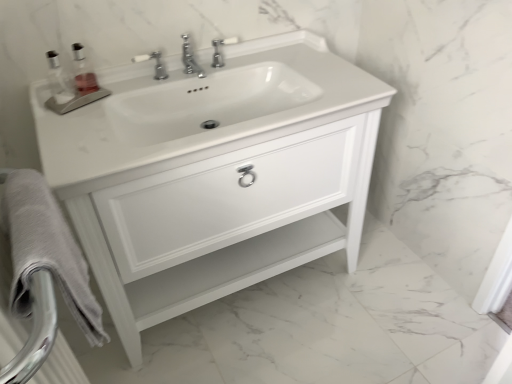
Question: From a real-world perspective, does white glossy sink at center sit lower than clear glass soap dispenser at upper left?

Choices:
 (A) yes
 (B) no

Answer: (A)

Question: Is white glossy sink at center oriented away from clear glass soap dispenser at upper left?

Choices:
 (A) no
 (B) yes

Answer: (A)

Question: Is white glossy sink at center at the right side of clear glass soap dispenser at upper left?

Choices:
 (A) yes
 (B) no

Answer: (A)

Question: Can you confirm if white glossy sink at center is shorter than clear glass soap dispenser at upper left?

Choices:
 (A) yes
 (B) no

Answer: (B)

Question: Is white glossy sink at center with clear glass soap dispenser at upper left?

Choices:
 (A) no
 (B) yes

Answer: (A)

Question: From a real-world perspective, is white glossy sink at center on clear glass soap dispenser at upper left?

Choices:
 (A) no
 (B) yes

Answer: (A)

Question: From the image's perspective, is white glossy cabinet at center on top of chrome metallic faucet at center?

Choices:
 (A) no
 (B) yes

Answer: (A)

Question: Is the depth of white glossy cabinet at center less than that of chrome metallic faucet at center?

Choices:
 (A) no
 (B) yes

Answer: (B)

Question: Is white glossy cabinet at center shorter than chrome metallic faucet at center?

Choices:
 (A) yes
 (B) no

Answer: (B)

Question: Considering the relative positions of white glossy cabinet at center and chrome metallic faucet at center in the image provided, is white glossy cabinet at center to the left of chrome metallic faucet at center from the viewer's perspective?

Choices:
 (A) no
 (B) yes

Answer: (A)

Question: Is white glossy cabinet at center to the right of chrome metallic faucet at center from the viewer's perspective?

Choices:
 (A) yes
 (B) no

Answer: (A)

Question: Does white glossy cabinet at center lie behind chrome metallic faucet at center?

Choices:
 (A) yes
 (B) no

Answer: (B)

Question: Does white glossy sink at center contain white glossy cabinet at center?

Choices:
 (A) yes
 (B) no

Answer: (B)